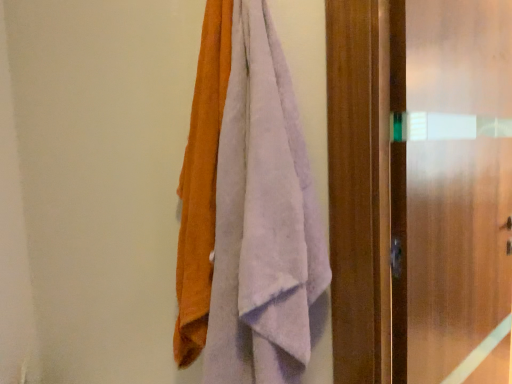
Question: Can you confirm if soft cotton towels at center is shorter than frosted glass screen door at right?

Choices:
 (A) no
 (B) yes

Answer: (B)

Question: From the image's perspective, is soft cotton towels at center below frosted glass screen door at right?

Choices:
 (A) yes
 (B) no

Answer: (B)

Question: Does soft cotton towels at center turn towards frosted glass screen door at right?

Choices:
 (A) no
 (B) yes

Answer: (A)

Question: Is soft cotton towels at center to the right of frosted glass screen door at right from the viewer's perspective?

Choices:
 (A) no
 (B) yes

Answer: (A)

Question: Considering the relative positions of soft cotton towels at center and frosted glass screen door at right in the image provided, is soft cotton towels at center behind frosted glass screen door at right?

Choices:
 (A) no
 (B) yes

Answer: (A)

Question: Can you confirm if soft cotton towels at center is wider than frosted glass screen door at right?

Choices:
 (A) no
 (B) yes

Answer: (B)

Question: Does frosted glass screen door at right have a greater width compared to soft cotton towels at center?

Choices:
 (A) no
 (B) yes

Answer: (A)

Question: Is frosted glass screen door at right smaller than soft cotton towels at center?

Choices:
 (A) yes
 (B) no

Answer: (B)

Question: Is frosted glass screen door at right located outside soft cotton towels at center?

Choices:
 (A) yes
 (B) no

Answer: (A)

Question: Does frosted glass screen door at right have a greater height compared to soft cotton towels at center?

Choices:
 (A) yes
 (B) no

Answer: (A)

Question: Can you confirm if frosted glass screen door at right is shorter than soft cotton towels at center?

Choices:
 (A) yes
 (B) no

Answer: (B)

Question: From the image's perspective, does frosted glass screen door at right appear higher than soft cotton towels at center?

Choices:
 (A) no
 (B) yes

Answer: (A)

Question: Is point (249, 99) closer or farther from the camera than point (498, 203)?

Choices:
 (A) closer
 (B) farther

Answer: (A)